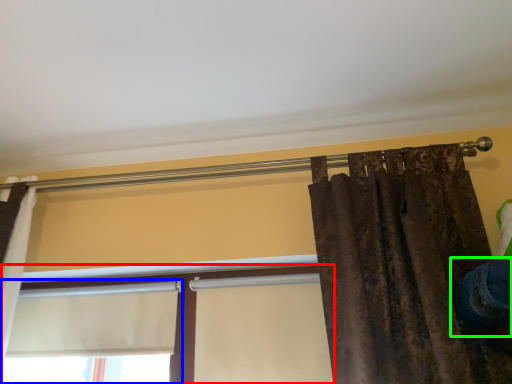
Question: Considering the real-world distances, which object is closest to window (highlighted by a red box)? window (highlighted by a blue box) or jeans (highlighted by a green box).

Choices:
 (A) window
 (B) jeans

Answer: (A)